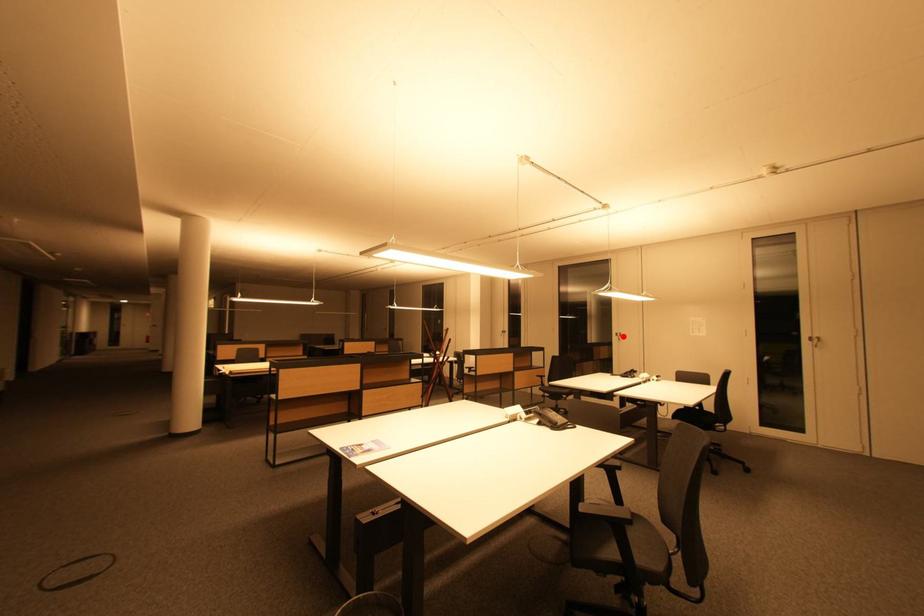
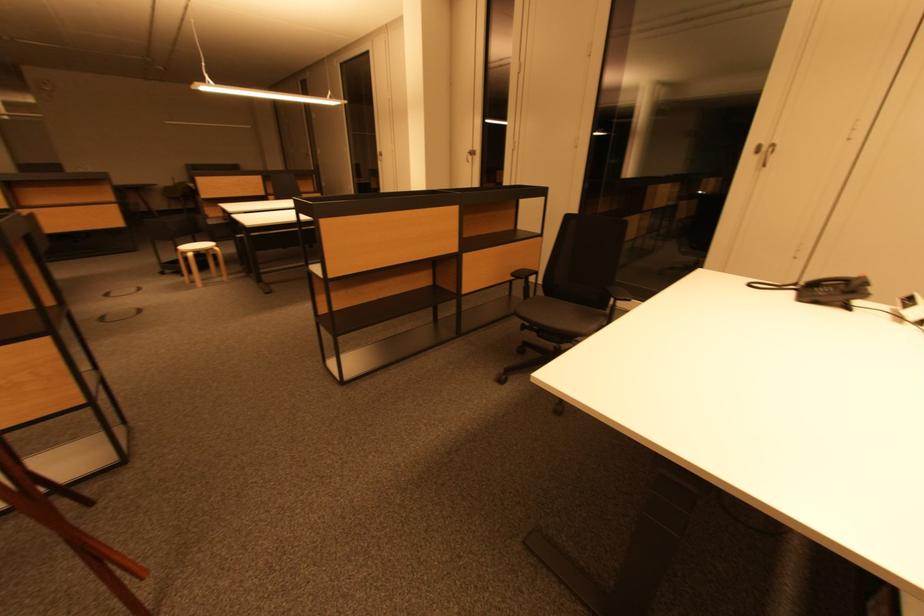
Question: I am providing you with two images of the same scene from different viewpoints. A red point is shown in image1. For the corresponding object point in image2, is it positioned nearer or farther from the camera?

Choices:
 (A) Nearer
 (B) Farther

Answer: (B)